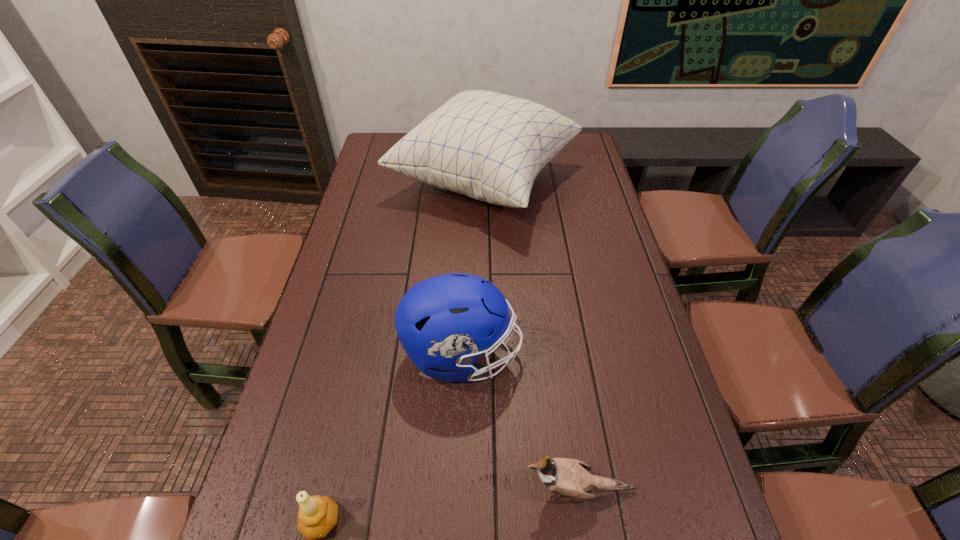
You are a GUI agent. You are given a task and a screenshot of the screen. Output one action in this format:
    pyautogui.click(x=<x>, y=<y>)
    Task: Click on the vacant space in between the second farthest object and the bird
    
    Given the screenshot: What is the action you would take?
    pyautogui.click(x=521, y=422)

At what (x,y) coordinates should I click in order to perform the action: click on vacant area that lies between the cushion and the bird. Please return your answer as a coordinate pair (x, y). The width and height of the screenshot is (960, 540). Looking at the image, I should click on (532, 335).

Where is `blank region between the third nearest object and the farthest object`? The width and height of the screenshot is (960, 540). blank region between the third nearest object and the farthest object is located at coordinates (473, 268).

The width and height of the screenshot is (960, 540). In order to click on vacant region between the bird and the farthest object in this screenshot , I will do coord(532,335).

Identify the location of object that stands as the third closest to the candle_holder. This screenshot has height=540, width=960. (488, 146).

Where is `object identified as the second closest to the second farthest object`? This screenshot has height=540, width=960. object identified as the second closest to the second farthest object is located at coordinates (317, 515).

What are the coordinates of `vacant space that satisfies the following two spatial constraints: 1. on the front side of the cushion; 2. on the front-facing side of the football helmet` in the screenshot? It's located at (488, 355).

This screenshot has width=960, height=540. I want to click on vacant region that satisfies the following two spatial constraints: 1. on the front side of the cushion; 2. on the front-facing side of the football helmet, so click(488, 355).